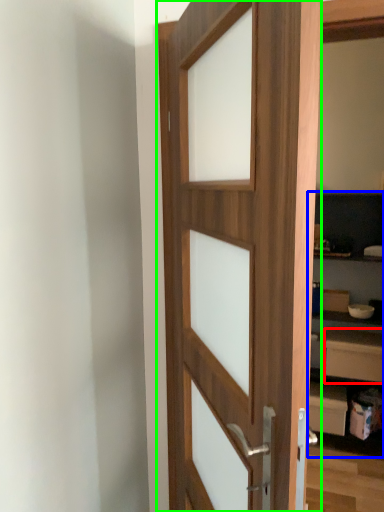
Question: Based on their relative distances, which object is farther from drawer (highlighted by a red box)? Choose from bookshelf (highlighted by a blue box) and door (highlighted by a green box).

Choices:
 (A) bookshelf
 (B) door

Answer: (B)